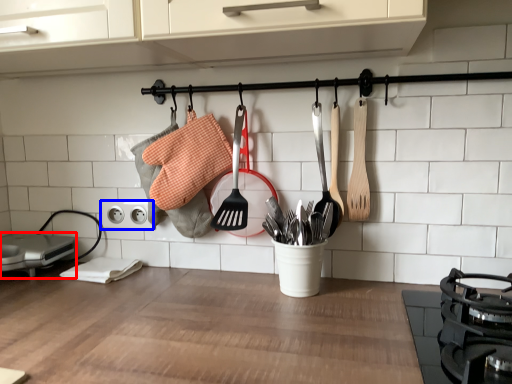
Question: Among these objects, which one is farthest to the camera, appliance (highlighted by a red box) or electric outlet (highlighted by a blue box)?

Choices:
 (A) appliance
 (B) electric outlet

Answer: (B)